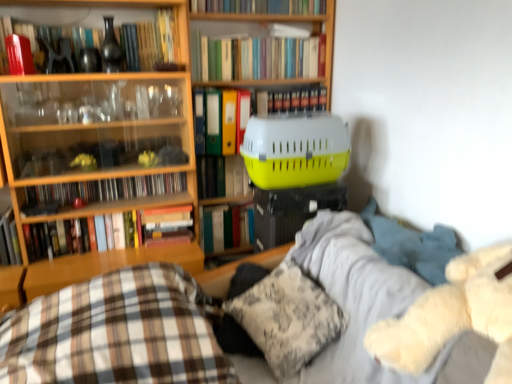
The image size is (512, 384). I want to click on blank space situated above green matte book at center, positioned as the third book in bottom-to-top order (from a real-world perspective), so click(x=229, y=201).